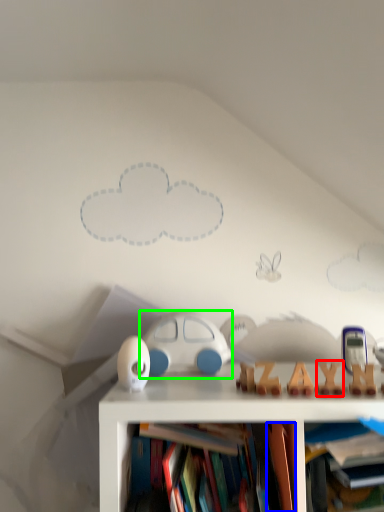
Question: Based on their relative distances, which object is farther from toy (highlighted by a red box)? Choose from book (highlighted by a blue box) and toy (highlighted by a green box).

Choices:
 (A) book
 (B) toy

Answer: (B)